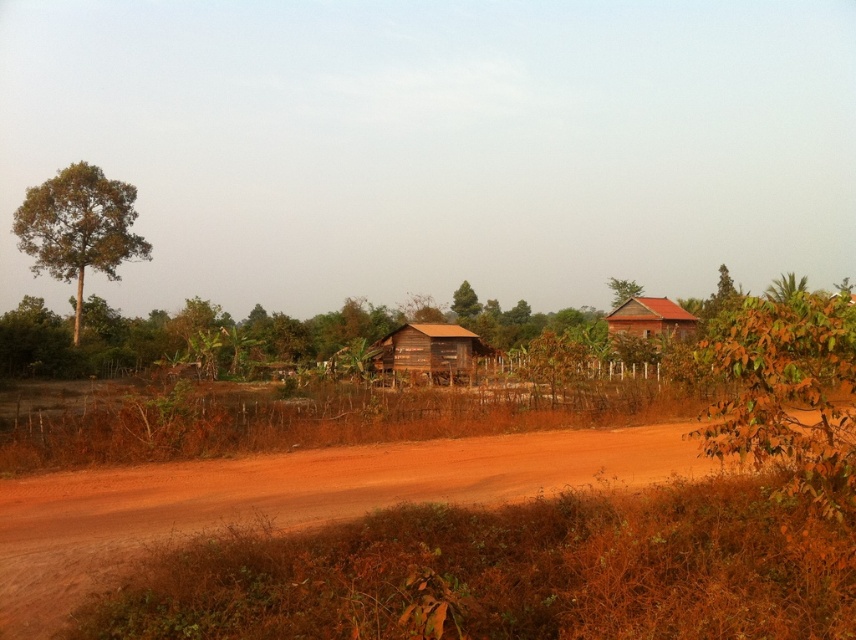
Based on the photo, you are a hiker who needs to take a photo of both the brown leafy tree at right and the green matte tree at center. Which tree should you stand closer to in order to capture both in a single frame?

You should stand closer to the green matte tree at center because the brown leafy tree at right is larger in size, so by positioning yourself near the smaller green matte tree at center, both trees will fit within the camera frame.

You are a hiker who has just arrived at the scene and wants to reach the red clay hut at right. Based on the image, which direction should you move from the brown dirt field at center to get there?

Since the brown dirt field at center is closer to the viewer than the red clay hut at right, you should move towards the background direction away from the viewer to reach the red clay hut at right.

You are a farmer planning to plant crops in the brown dirt field at center and the green matte tree at center. Which area has more space available for planting?

The green matte tree at center has more space available for planting because it is larger than the brown dirt field at center.